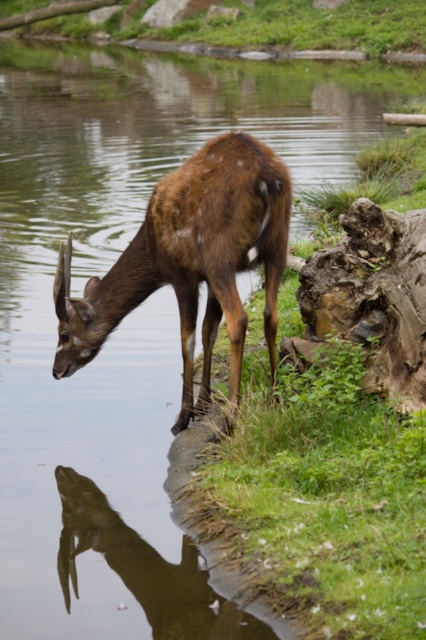
Can you confirm if brown matte/deer at center is wider than brown glossy antelope at lower left?

Yes.

Can you confirm if brown matte/deer at center is shorter than brown glossy antelope at lower left?

No.

The height and width of the screenshot is (640, 426). Identify the location of brown matte/deer at center. (189, 260).